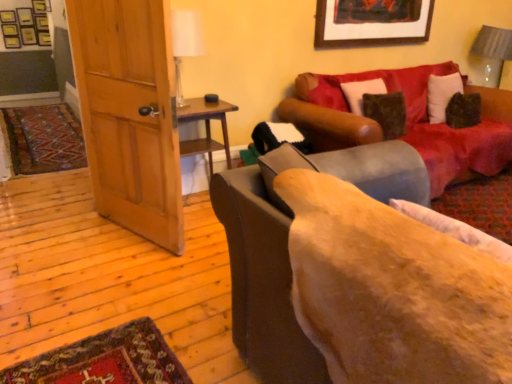
At what (x,y) coordinates should I click in order to perform the action: click on vacant space that is to the left of wooden door at left. Please return your answer as a coordinate pair (x, y). This screenshot has height=384, width=512. Looking at the image, I should click on (60, 243).